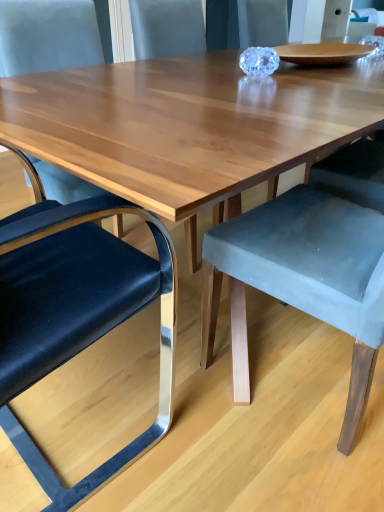
The height and width of the screenshot is (512, 384). In order to click on velvet grey chair at center, which is counted as the third chair, starting from the left in this screenshot , I will do `click(302, 280)`.

Consider the image. Are velvet grey chair at center, which is counted as the third chair, starting from the left, and velvet blue chair at left, which is counted as the second chair, starting from the left, beside each other?

They are not placed beside each other.

Which of these two, velvet grey chair at center, which is counted as the third chair, starting from the left, or velvet blue chair at left, acting as the 2th chair starting from the right, is wider?

velvet grey chair at center, which is counted as the third chair, starting from the left, is wider.

Which is more to the right, velvet grey chair at center, which appears as the 1th chair when viewed from the right, or velvet blue chair at left, acting as the 2th chair starting from the right?

Positioned to the right is velvet grey chair at center, which appears as the 1th chair when viewed from the right.

From a real-world perspective, which object stands above the other?

velvet blue chair at left, acting as the 2th chair starting from the right, is physically above.

Is metallic blue cushioned chair at left, the 1th chair from the left, positioned beyond the bounds of velvet blue chair at left, acting as the 2th chair starting from the right?

Answer: That's correct, metallic blue cushioned chair at left, the 1th chair from the left, is outside of velvet blue chair at left, acting as the 2th chair starting from the right.

From the metallic blue cushioned chair at left, which ranks as the third chair in right-to-left order, count 2nd chairs backward and point to it. Please provide its 2D coordinates.

[(47, 35)]

Looking at this image, can you confirm if metallic blue cushioned chair at left, the 1th chair from the left, is positioned to the right of velvet blue chair at left, which is counted as the second chair, starting from the left?

No, metallic blue cushioned chair at left, the 1th chair from the left, is not to the right of velvet blue chair at left, which is counted as the second chair, starting from the left.

In terms of height, does metallic blue cushioned chair at left, which ranks as the third chair in right-to-left order, look taller or shorter compared to velvet blue chair at left, which is counted as the second chair, starting from the left?

metallic blue cushioned chair at left, which ranks as the third chair in right-to-left order, is shorter than velvet blue chair at left, which is counted as the second chair, starting from the left.

This screenshot has width=384, height=512. I want to click on chair above the velvet grey chair at center, which is counted as the third chair, starting from the left (from a real-world perspective), so point(47,35).

Between velvet blue chair at left, acting as the 2th chair starting from the right, and velvet grey chair at center, which is counted as the third chair, starting from the left, which one has larger size?

velvet grey chair at center, which is counted as the third chair, starting from the left, is bigger.

From the image's perspective, relative to velvet grey chair at center, which is counted as the third chair, starting from the left, is velvet blue chair at left, which is counted as the second chair, starting from the left, above or below?

Based on their image positions, velvet blue chair at left, which is counted as the second chair, starting from the left, is located above velvet grey chair at center, which is counted as the third chair, starting from the left.

Does velvet blue chair at left, acting as the 2th chair starting from the right, come behind metallic blue cushioned chair at left, the 1th chair from the left?

Yes, it is behind metallic blue cushioned chair at left, the 1th chair from the left.

Is velvet blue chair at left, acting as the 2th chair starting from the right, facing away from metallic blue cushioned chair at left, which ranks as the third chair in right-to-left order?

velvet blue chair at left, acting as the 2th chair starting from the right, does not have its back to metallic blue cushioned chair at left, which ranks as the third chair in right-to-left order.

In the scene shown: Which object is positioned more to the left, velvet blue chair at left, which is counted as the second chair, starting from the left, or metallic blue cushioned chair at left, the 1th chair from the left?

metallic blue cushioned chair at left, the 1th chair from the left.

Is velvet blue chair at left, which is counted as the second chair, starting from the left, surrounding metallic blue cushioned chair at left, the 1th chair from the left?

No, metallic blue cushioned chair at left, the 1th chair from the left, is located outside of velvet blue chair at left, which is counted as the second chair, starting from the left.

From the image's perspective, relative to velvet grey chair at center, which is counted as the third chair, starting from the left, is metallic blue cushioned chair at left, which ranks as the third chair in right-to-left order, above or below?

From the image's perspective, metallic blue cushioned chair at left, which ranks as the third chair in right-to-left order, appears below velvet grey chair at center, which is counted as the third chair, starting from the left.

Between metallic blue cushioned chair at left, the 1th chair from the left, and velvet grey chair at center, which is counted as the third chair, starting from the left, which one appears on the left side from the viewer's perspective?

Positioned to the left is metallic blue cushioned chair at left, the 1th chair from the left.

Which of these two, metallic blue cushioned chair at left, the 1th chair from the left, or velvet grey chair at center, which is counted as the third chair, starting from the left, stands taller?

Standing taller between the two is velvet grey chair at center, which is counted as the third chair, starting from the left.

Is point (105, 201) positioned behind point (375, 240)?

No, (105, 201) is closer to viewer.

Is velvet grey chair at center, which appears as the 1th chair when viewed from the right, in front of or behind metallic blue cushioned chair at left, which ranks as the third chair in right-to-left order, in the image?

velvet grey chair at center, which appears as the 1th chair when viewed from the right, is positioned farther from the viewer than metallic blue cushioned chair at left, which ranks as the third chair in right-to-left order.

Is metallic blue cushioned chair at left, which ranks as the third chair in right-to-left order, a part of velvet grey chair at center, which is counted as the third chair, starting from the left?

Actually, metallic blue cushioned chair at left, which ranks as the third chair in right-to-left order, is outside velvet grey chair at center, which is counted as the third chair, starting from the left.

From a real-world perspective, is velvet grey chair at center, which is counted as the third chair, starting from the left, above or below metallic blue cushioned chair at left, the 1th chair from the left?

velvet grey chair at center, which is counted as the third chair, starting from the left, is situated higher than metallic blue cushioned chair at left, the 1th chair from the left, in the real world.

Where is `chair located on the right of velvet blue chair at left, acting as the 2th chair starting from the right`? The height and width of the screenshot is (512, 384). chair located on the right of velvet blue chair at left, acting as the 2th chair starting from the right is located at coordinates (302, 280).

From the image's perspective, starting from the velvet blue chair at left, acting as the 2th chair starting from the right, which chair is the 2nd one below? Please provide its 2D coordinates.

[(76, 311)]

Estimate the real-world distances between objects in this image. Which object is closer to metallic blue cushioned chair at left, which ranks as the third chair in right-to-left order, velvet blue chair at left, which is counted as the second chair, starting from the left, or velvet grey chair at center, which appears as the 1th chair when viewed from the right?

Among the two, velvet grey chair at center, which appears as the 1th chair when viewed from the right, is located nearer to metallic blue cushioned chair at left, which ranks as the third chair in right-to-left order.

Which object lies nearer to the anchor point velvet grey chair at center, which appears as the 1th chair when viewed from the right, metallic blue cushioned chair at left, which ranks as the third chair in right-to-left order, or velvet blue chair at left, which is counted as the second chair, starting from the left?

metallic blue cushioned chair at left, which ranks as the third chair in right-to-left order, is positioned closer to the anchor velvet grey chair at center, which appears as the 1th chair when viewed from the right.

Which object lies further to the anchor point metallic blue cushioned chair at left, the 1th chair from the left, velvet grey chair at center, which appears as the 1th chair when viewed from the right, or velvet blue chair at left, acting as the 2th chair starting from the right?

Among the two, velvet blue chair at left, acting as the 2th chair starting from the right, is located further to metallic blue cushioned chair at left, the 1th chair from the left.

Considering their positions, is metallic blue cushioned chair at left, which ranks as the third chair in right-to-left order, positioned closer to velvet blue chair at left, which is counted as the second chair, starting from the left, than velvet grey chair at center, which is counted as the third chair, starting from the left?

The object closer to velvet blue chair at left, which is counted as the second chair, starting from the left, is metallic blue cushioned chair at left, which ranks as the third chair in right-to-left order.

When comparing their distances from velvet blue chair at left, acting as the 2th chair starting from the right, does velvet grey chair at center, which is counted as the third chair, starting from the left, or metallic blue cushioned chair at left, which ranks as the third chair in right-to-left order, seem further?

velvet grey chair at center, which is counted as the third chair, starting from the left, is further to velvet blue chair at left, acting as the 2th chair starting from the right.

Based on their spatial positions, is velvet blue chair at left, acting as the 2th chair starting from the right, or metallic blue cushioned chair at left, which ranks as the third chair in right-to-left order, further from velvet grey chair at center, which appears as the 1th chair when viewed from the right?

velvet blue chair at left, acting as the 2th chair starting from the right, lies further to velvet grey chair at center, which appears as the 1th chair when viewed from the right, than the other object.

Find the location of a particular element. The height and width of the screenshot is (512, 384). chair between metallic blue cushioned chair at left, the 1th chair from the left, and velvet grey chair at center, which is counted as the third chair, starting from the left is located at coordinates (47, 35).